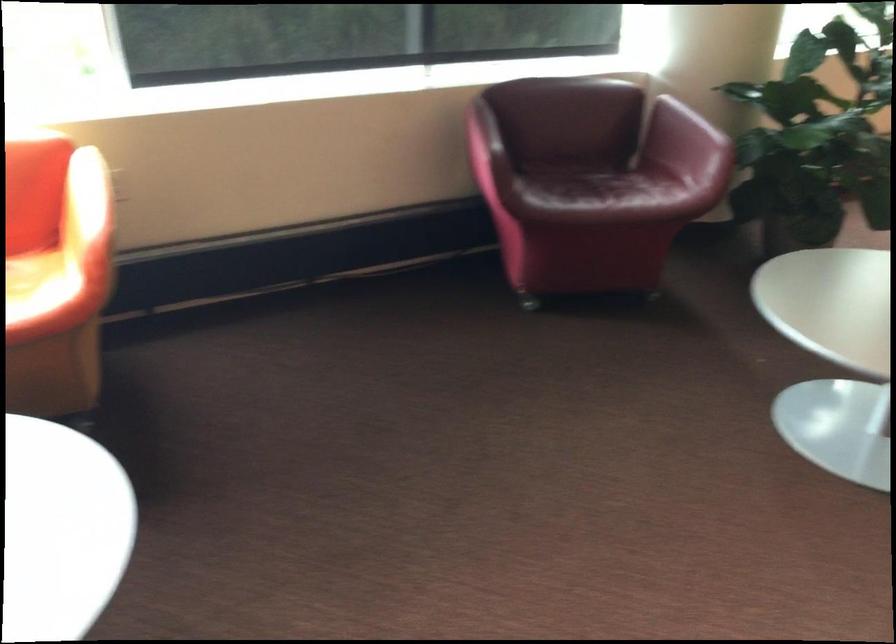
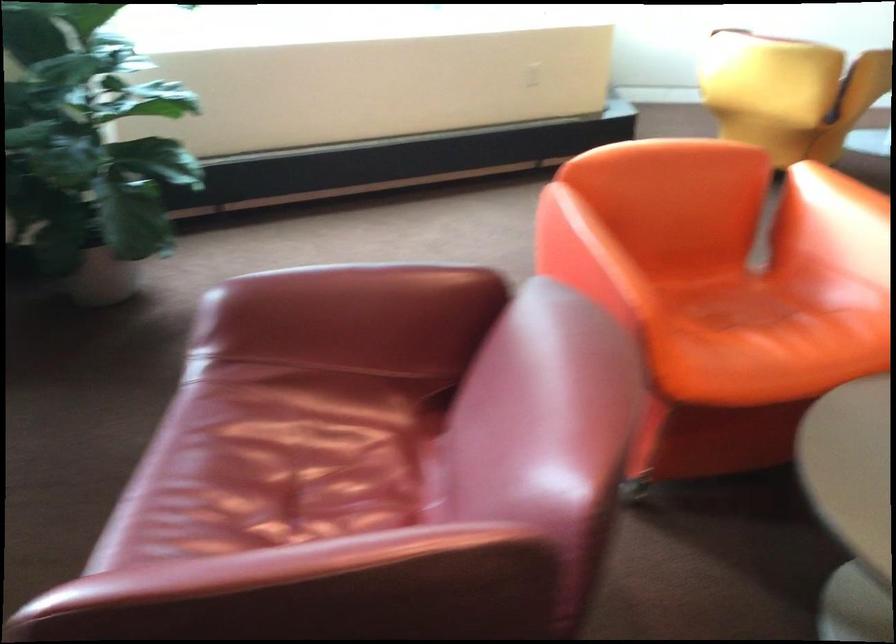
Question: Which direction would the cameraman need to move to produce the second image? Reply with the corresponding letter.

Choices:
 (A) Left
 (B) Right
 (C) Forward
 (D) Backward

Answer: (B)